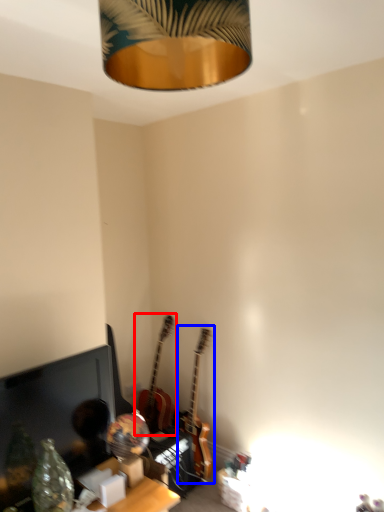
Question: Which object appears farthest to the camera in this image, guitar (highlighted by a red box) or guitar (highlighted by a blue box)?

Choices:
 (A) guitar
 (B) guitar

Answer: (A)